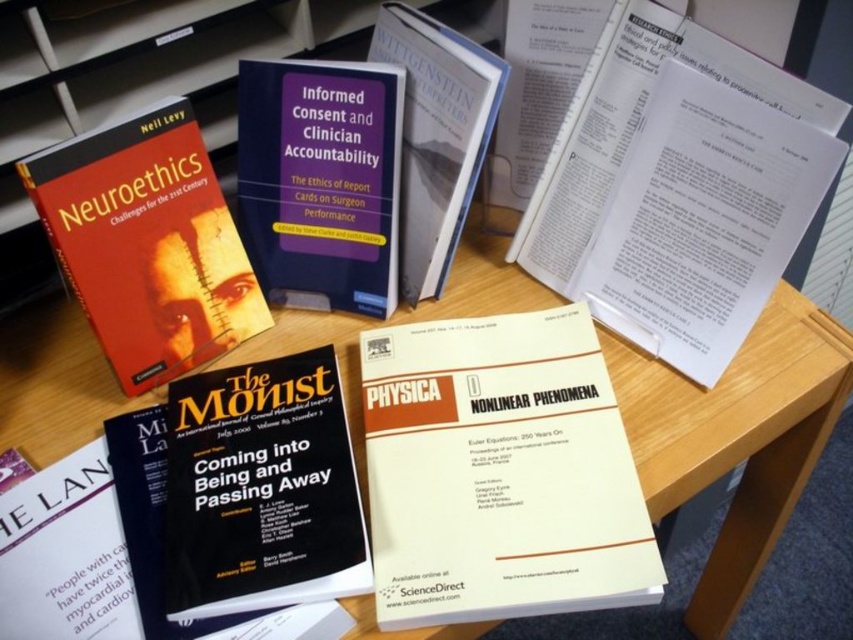
Question: Among these points, which one is farthest from the camera?

Choices:
 (A) (258, 312)
 (B) (405, 467)
 (C) (283, 170)
 (D) (837, 392)

Answer: (D)

Question: In this image, where is white paper at center located relative to black paper book at center?

Choices:
 (A) above
 (B) below

Answer: (A)

Question: Can you confirm if white paper at center is wider than black paper book at center?

Choices:
 (A) no
 (B) yes

Answer: (B)

Question: Does white paper document at upper right have a lesser width compared to matte hardcover book at upper left?

Choices:
 (A) no
 (B) yes

Answer: (A)

Question: Considering the real-world distances, which object is closest to the black matte book at lower left?

Choices:
 (A) white paper document at upper right
 (B) hardcover book at center
 (C) matte hardcover book at upper left

Answer: (C)

Question: Among these points, which one is farthest from the camera?

Choices:
 (A) click(x=140, y=625)
 (B) click(x=339, y=214)
 (C) click(x=175, y=250)

Answer: (B)